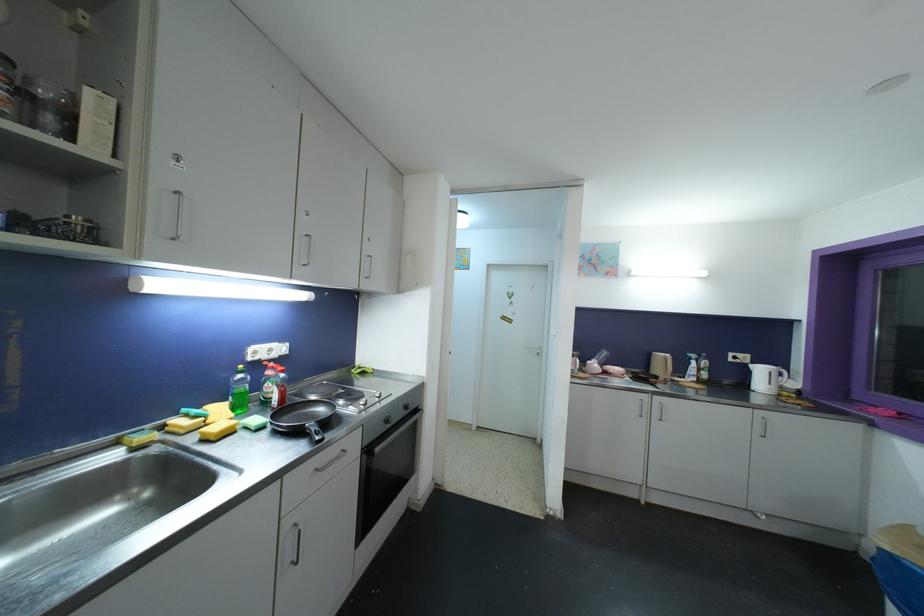
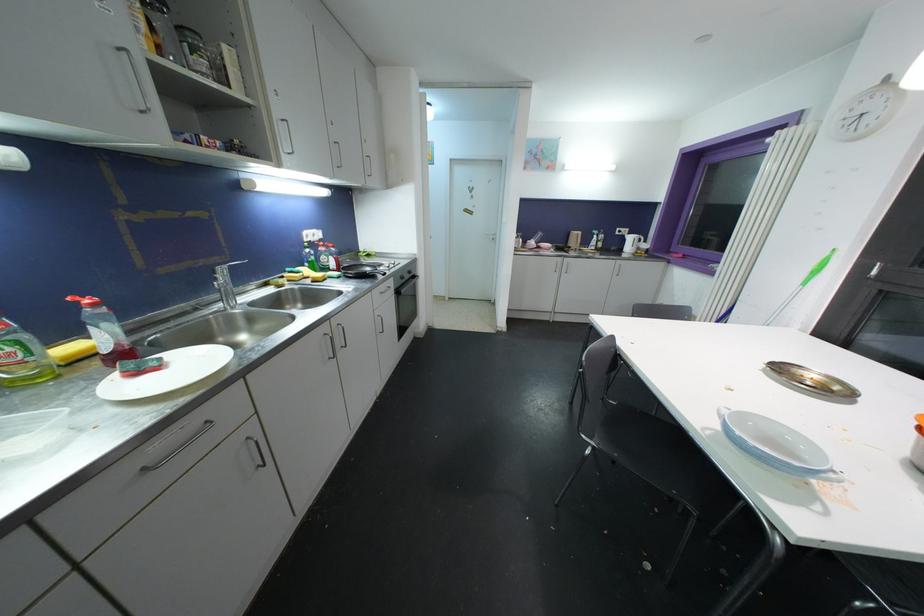
Locate, in the second image, the point that corresponds to point 408,410 in the first image.

(412, 275)